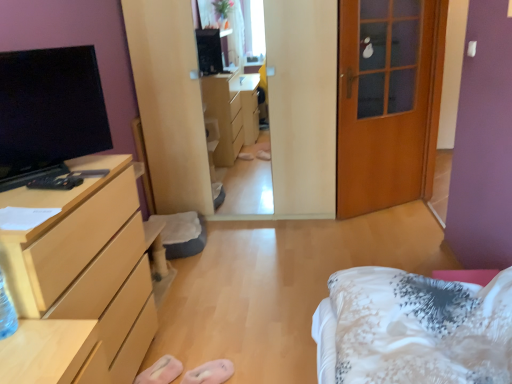
Question: From a real-world perspective, is pink fabric slipper at lower center, the 2th shoe positioned from the left, over black glossy tv at left?

Choices:
 (A) yes
 (B) no

Answer: (B)

Question: Does pink fabric slipper at lower center, the 2th shoe positioned from the left, have a greater width compared to black glossy tv at left?

Choices:
 (A) no
 (B) yes

Answer: (B)

Question: From the image's perspective, is pink fabric slipper at lower center, positioned as the 1th shoe in right-to-left order, located beneath black glossy tv at left?

Choices:
 (A) no
 (B) yes

Answer: (B)

Question: Does pink fabric slipper at lower center, the 2th shoe positioned from the left, have a greater height compared to black glossy tv at left?

Choices:
 (A) no
 (B) yes

Answer: (A)

Question: Considering the relative sizes of pink fabric slipper at lower center, the 2th shoe positioned from the left, and black glossy tv at left in the image provided, is pink fabric slipper at lower center, the 2th shoe positioned from the left, smaller than black glossy tv at left?

Choices:
 (A) yes
 (B) no

Answer: (A)

Question: Relative to light wood/finish chest of drawers at left, is wooden door at right in front or behind?

Choices:
 (A) front
 (B) behind

Answer: (B)

Question: Is wooden door at right spatially inside light wood/finish chest of drawers at left, or outside of it?

Choices:
 (A) outside
 (B) inside

Answer: (A)

Question: Looking at their shapes, would you say wooden door at right is wider or thinner than light wood/finish chest of drawers at left?

Choices:
 (A) wide
 (B) thin

Answer: (B)

Question: Is point (372, 178) closer or farther from the camera than point (74, 319)?

Choices:
 (A) closer
 (B) farther

Answer: (B)

Question: Is light wood/finish chest of drawers at left to the left or to the right of black glossy tv at left in the image?

Choices:
 (A) left
 (B) right

Answer: (A)

Question: From the image's perspective, is light wood/finish chest of drawers at left located above or below black glossy tv at left?

Choices:
 (A) below
 (B) above

Answer: (A)

Question: Does point (93, 324) appear closer or farther from the camera than point (6, 81)?

Choices:
 (A) closer
 (B) farther

Answer: (A)

Question: Is light wood/finish chest of drawers at left wider or thinner than black glossy tv at left?

Choices:
 (A) thin
 (B) wide

Answer: (B)

Question: Considering the relative positions of pink fabric slipper at lower center, the 2th shoe positioned from the left, and pink fabric slipper at lower center, marked as the 1th shoe in a left-to-right arrangement, in the image provided, is pink fabric slipper at lower center, the 2th shoe positioned from the left, to the left or to the right of pink fabric slipper at lower center, marked as the 1th shoe in a left-to-right arrangement,?

Choices:
 (A) left
 (B) right

Answer: (B)

Question: Is point (206, 370) closer or farther from the camera than point (161, 362)?

Choices:
 (A) farther
 (B) closer

Answer: (B)